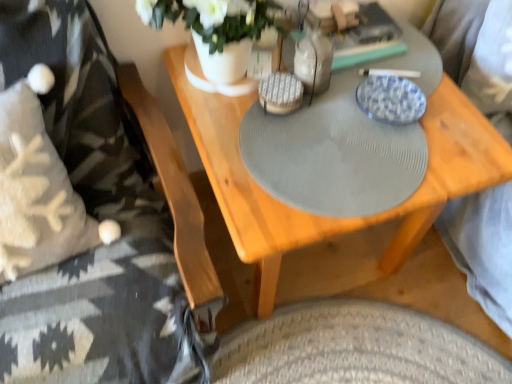
The image size is (512, 384). In order to click on vacant area on the back side of blue glazed plate at upper center in this screenshot , I will do `click(391, 63)`.